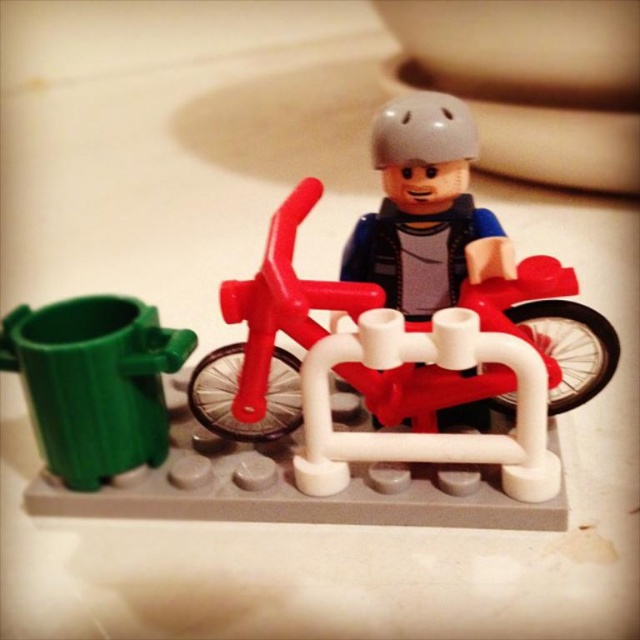
Question: Does matte plastic bicycle at center appear over gray matte helmet at center?

Choices:
 (A) yes
 (B) no

Answer: (B)

Question: Which is farther from the matte plastic bicycle at center?

Choices:
 (A) gray matte helmet at center
 (B) green plastic trash can at left
 (C) matte red motorcycle at center

Answer: (A)

Question: Does matte plastic bicycle at center have a lesser width compared to gray matte helmet at center?

Choices:
 (A) yes
 (B) no

Answer: (B)

Question: Which of the following is the closest to the observer?

Choices:
 (A) green plastic trash can at left
 (B) matte plastic bicycle at center
 (C) gray matte helmet at center

Answer: (B)

Question: Can you confirm if matte red motorcycle at center is positioned to the left of gray matte helmet at center?

Choices:
 (A) yes
 (B) no

Answer: (A)

Question: Among these points, which one is farthest from the camera?

Choices:
 (A) (445, 404)
 (B) (176, 474)
 (C) (403, 104)

Answer: (B)